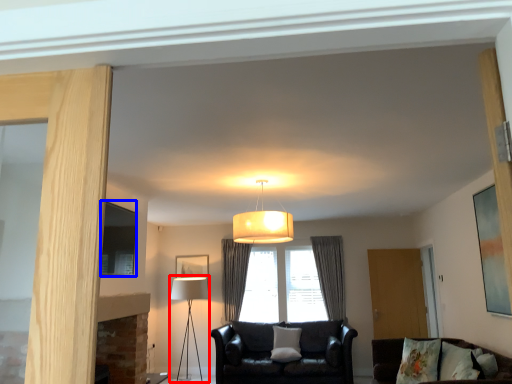
Question: Which object is further to the camera taking this photo, table lamp (highlighted by a red box) or picture frame (highlighted by a blue box)?

Choices:
 (A) table lamp
 (B) picture frame

Answer: (A)